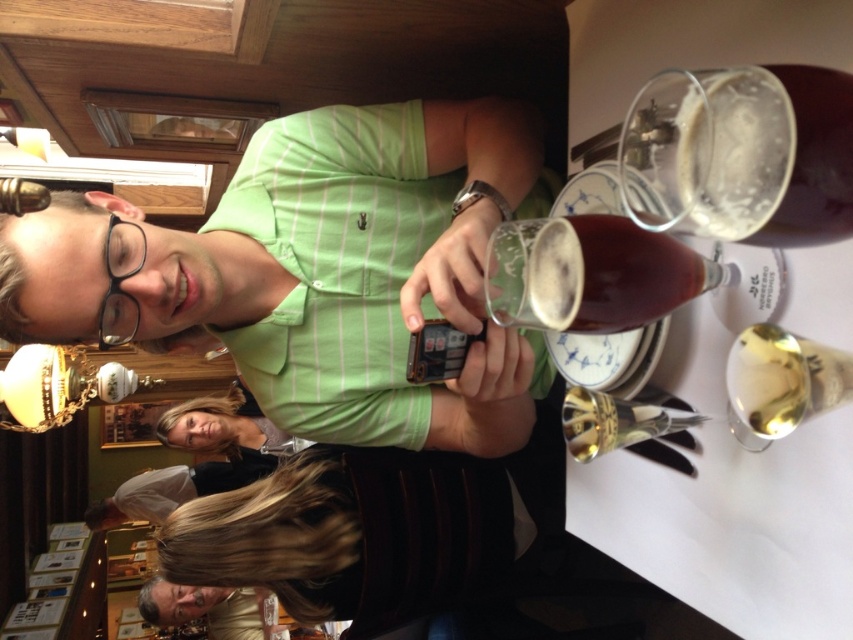
Which is below, clear glass at upper right or brown matte glass at upper center?

brown matte glass at upper center

Is point (775, 209) positioned behind point (576, 320)?

No, it is not.

Where is `clear glass at upper right`? clear glass at upper right is located at coordinates (776, 156).

From the picture: Is brown matte glass at upper center positioned before translucent glass at upper right?

No, it is behind translucent glass at upper right.

Describe the element at coordinates (612, 275) in the screenshot. I see `brown matte glass at upper center` at that location.

Is point (624, 310) closer to viewer compared to point (766, 342)?

No, it is not.

Find the location of a particular element. This screenshot has height=640, width=853. brown matte glass at upper center is located at coordinates (612, 275).

Which is above, green striped shirt at center or translucent glass at upper right?

green striped shirt at center is higher up.

Can you confirm if green striped shirt at center is taller than translucent glass at upper right?

Correct, green striped shirt at center is much taller as translucent glass at upper right.

Is point (358, 156) positioned in front of point (776, 403)?

No, it is not.

At what (x,y) coordinates should I click in order to perform the action: click on green striped shirt at center. Please return your answer as a coordinate pair (x, y). Looking at the image, I should click on (316, 272).